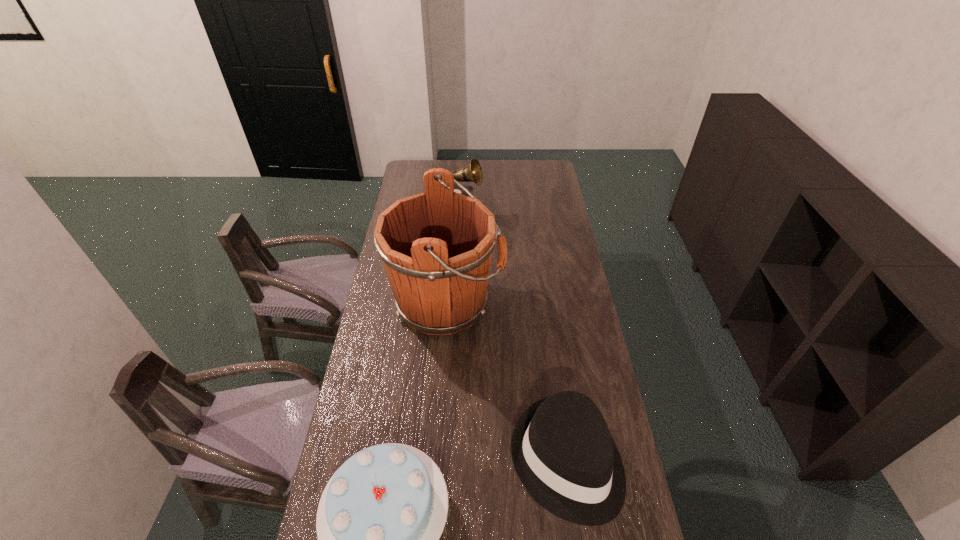
You are a GUI agent. You are given a task and a screenshot of the screen. Output one action in this format:
    pyautogui.click(x=<x>, y=<y>)
    Task: Click on the bucket
    Image resolution: width=960 pixels, height=540 pixels.
    Given the screenshot: What is the action you would take?
    pyautogui.click(x=436, y=246)

Identify the location of the third nearest object. Image resolution: width=960 pixels, height=540 pixels. (436, 246).

Locate an element on the screen. The image size is (960, 540). the farthest object is located at coordinates (472, 172).

Where is `phonograph record`? phonograph record is located at coordinates (472, 172).

The height and width of the screenshot is (540, 960). Find the location of `fedora`. fedora is located at coordinates (562, 450).

The height and width of the screenshot is (540, 960). Find the location of `vacant point located with the handle on the side of the bucket`. vacant point located with the handle on the side of the bucket is located at coordinates (543, 302).

Where is `vacant space situated on the horn of the third shortest object`? The image size is (960, 540). vacant space situated on the horn of the third shortest object is located at coordinates (556, 212).

Locate an element on the screen. free point located on the left of the fedora is located at coordinates (398, 460).

You are a GUI agent. You are given a task and a screenshot of the screen. Output one action in this format:
    pyautogui.click(x=<x>, y=<y>)
    Task: Click on the object that is at the left edge
    This screenshot has width=960, height=540.
    Given the screenshot: What is the action you would take?
    436,246

Identify the location of object situated at the right edge. The image size is (960, 540). (562, 450).